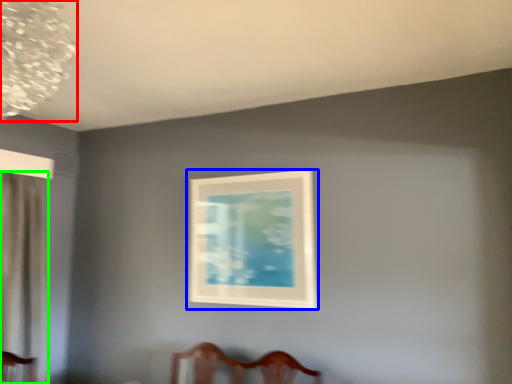
Question: Based on their relative distances, which object is farther from lamp (highlighted by a red box)? Choose from picture frame (highlighted by a blue box) and curtain (highlighted by a green box).

Choices:
 (A) picture frame
 (B) curtain

Answer: (A)